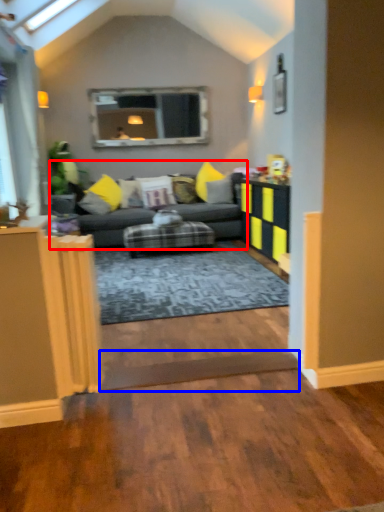
Question: Which object appears farthest to the camera in this image, studio couch (highlighted by a red box) or plank (highlighted by a blue box)?

Choices:
 (A) studio couch
 (B) plank

Answer: (A)